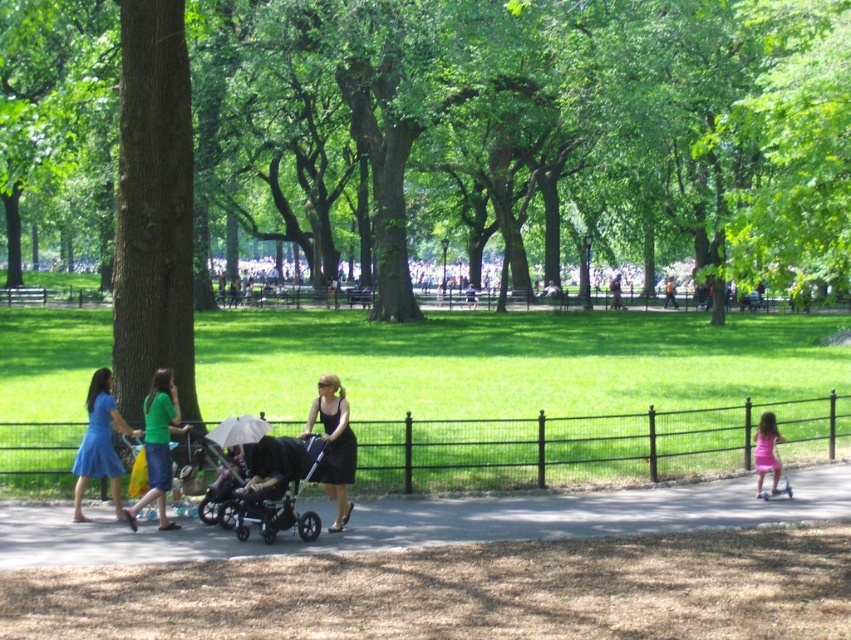
Where is the green matte dress at center located in the image?

The green matte dress at center is located at point 0.697 on the x axis and 0.187 on the y axis.

You are standing at the center of the park and want to locate the black fabric stroller at center. According to the coordinates provided, in which direction should you move from your current position to find it?

The black fabric stroller at center is located at coordinates point [271,486]. Since you are at the center, which is typically considered as point [425,320], you should move towards the right and slightly upward to reach the stroller.

You are a photographer standing at the park entrance. You want to take a photo of the black fabric stroller at center and the black satin dress at center so that both are clearly visible in the frame. Based on their positions, which object should you focus on first to ensure both are in focus?

The black fabric stroller at center is located below the black satin dress at center. To ensure both are in focus, you should focus on the black satin dress at center first since it is farther away from the camera, allowing the stroller below it to also be within the depth of field.